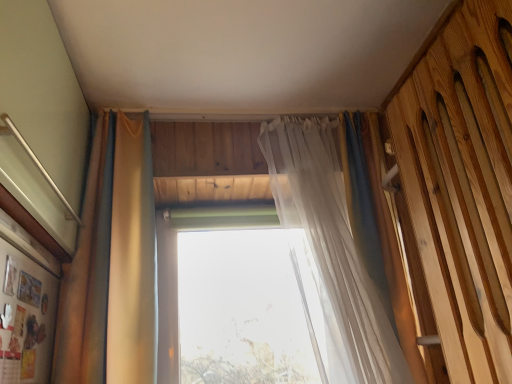
This screenshot has width=512, height=384. Identify the location of wooden slats bed at right. (463, 185).

Where is `translucent fabric curtain at center, placed as the 1th curtain when sorted from right to left`? translucent fabric curtain at center, placed as the 1th curtain when sorted from right to left is located at coordinates (331, 250).

In the scene shown: What is the approximate width of translucent fabric curtain at center, placed as the 1th curtain when sorted from right to left?

The width of translucent fabric curtain at center, placed as the 1th curtain when sorted from right to left, is 20.40 centimeters.

Identify the location of transparent glass window at center. (238, 300).

Locate an element on the screen. wooden slats bed at right is located at coordinates (463, 185).

From the image's perspective, who appears lower, translucent fabric curtain at center, positioned as the second curtain in left-to-right order, or wooden slats bed at right?

translucent fabric curtain at center, positioned as the second curtain in left-to-right order.

Looking at the image, does translucent fabric curtain at center, placed as the 1th curtain when sorted from right to left, seem bigger or smaller compared to wooden slats bed at right?

Considering their sizes, translucent fabric curtain at center, placed as the 1th curtain when sorted from right to left, takes up more space than wooden slats bed at right.

Is translucent fabric curtain at center, positioned as the second curtain in left-to-right order, in front of wooden slats bed at right?

No, translucent fabric curtain at center, positioned as the second curtain in left-to-right order, is further to the viewer.

From the picture: How many degrees apart are the facing directions of transparent glass window at center and translucent fabric curtain at center, placed as the 1th curtain when sorted from right to left?

The angular difference between transparent glass window at center and translucent fabric curtain at center, placed as the 1th curtain when sorted from right to left, is 0.304 degrees.

Is transparent glass window at center outside of translucent fabric curtain at center, positioned as the second curtain in left-to-right order?

transparent glass window at center lies outside translucent fabric curtain at center, positioned as the second curtain in left-to-right order,'s area.

Is transparent glass window at center at the left side of translucent fabric curtain at center, positioned as the second curtain in left-to-right order?

Yes, transparent glass window at center is to the left of translucent fabric curtain at center, positioned as the second curtain in left-to-right order.

Can you confirm if transparent glass window at center is wider than translucent fabric curtain at center, placed as the 1th curtain when sorted from right to left?

No.

Does transparent glass window at center have a larger size compared to matte gold curtain at left, which is the 2th curtain from right to left?

No.

Between point (274, 231) and point (83, 382), which one is positioned in front?

The point (83, 382) is closer to the camera.

Consider the image. Considering the relative sizes of transparent glass window at center and matte gold curtain at left, placed as the first curtain when sorted from left to right, in the image provided, is transparent glass window at center shorter than matte gold curtain at left, placed as the first curtain when sorted from left to right,?

Indeed, transparent glass window at center has a lesser height compared to matte gold curtain at left, placed as the first curtain when sorted from left to right.

Which of these two, matte gold curtain at left, placed as the first curtain when sorted from left to right, or wooden slats bed at right, stands taller?

matte gold curtain at left, placed as the first curtain when sorted from left to right.

Considering their positions, is matte gold curtain at left, placed as the first curtain when sorted from left to right, located in front of or behind wooden slats bed at right?

matte gold curtain at left, placed as the first curtain when sorted from left to right, is behind wooden slats bed at right.

Which is closer, (135, 223) or (414, 162)?

The point (414, 162) is closer.

Between translucent fabric curtain at center, placed as the 1th curtain when sorted from right to left, and matte gold curtain at left, which is the 2th curtain from right to left, which one has smaller size?

matte gold curtain at left, which is the 2th curtain from right to left, is smaller.

Looking at their sizes, would you say translucent fabric curtain at center, positioned as the second curtain in left-to-right order, is wider or thinner than matte gold curtain at left, which is the 2th curtain from right to left?

Clearly, translucent fabric curtain at center, positioned as the second curtain in left-to-right order, has more width compared to matte gold curtain at left, which is the 2th curtain from right to left.

Is translucent fabric curtain at center, placed as the 1th curtain when sorted from right to left, positioned in front of matte gold curtain at left, placed as the first curtain when sorted from left to right?

No, it is behind matte gold curtain at left, placed as the first curtain when sorted from left to right.

Does point (379, 307) come farther from viewer compared to point (99, 310)?

That is True.

Does wooden slats bed at right have a greater width compared to translucent fabric curtain at center, positioned as the second curtain in left-to-right order?

No, wooden slats bed at right is not wider than translucent fabric curtain at center, positioned as the second curtain in left-to-right order.

This screenshot has height=384, width=512. In order to click on curtain that is the 1st one above the wooden slats bed at right (from a real-world perspective) in this screenshot , I will do `click(331, 250)`.

Is wooden slats bed at right beside translucent fabric curtain at center, positioned as the second curtain in left-to-right order?

No, wooden slats bed at right is not next to translucent fabric curtain at center, positioned as the second curtain in left-to-right order.

Which is more to the left, wooden slats bed at right or translucent fabric curtain at center, placed as the 1th curtain when sorted from right to left?

translucent fabric curtain at center, placed as the 1th curtain when sorted from right to left.

Which is behind, point (485, 320) or point (66, 343)?

The point (66, 343) is farther from the camera.

From the image's perspective, which one is positioned higher, wooden slats bed at right or matte gold curtain at left, placed as the first curtain when sorted from left to right?

wooden slats bed at right, from the image's perspective.

I want to click on the 1st curtain to the left when counting from the wooden slats bed at right, so click(331, 250).

Which curtain is the 1st one when counting from the front of the transparent glass window at center? Please provide its 2D coordinates.

[(331, 250)]

From the image, which object appears to be nearer to wooden slats bed at right, translucent fabric curtain at center, positioned as the second curtain in left-to-right order, or matte gold curtain at left, which is the 2th curtain from right to left?

Based on the image, translucent fabric curtain at center, positioned as the second curtain in left-to-right order, appears to be nearer to wooden slats bed at right.

Based on their spatial positions, is translucent fabric curtain at center, positioned as the second curtain in left-to-right order, or wooden slats bed at right further from transparent glass window at center?

wooden slats bed at right.

From the image, which object appears to be farther from transparent glass window at center, matte gold curtain at left, placed as the first curtain when sorted from left to right, or translucent fabric curtain at center, placed as the 1th curtain when sorted from right to left?

Among the two, matte gold curtain at left, placed as the first curtain when sorted from left to right, is located further to transparent glass window at center.

Looking at this image, estimate the real-world distances between objects in this image. Which object is further from transparent glass window at center, wooden slats bed at right or matte gold curtain at left, placed as the first curtain when sorted from left to right?

Among the two, wooden slats bed at right is located further to transparent glass window at center.

Which object lies nearer to the anchor point matte gold curtain at left, placed as the first curtain when sorted from left to right, wooden slats bed at right or translucent fabric curtain at center, placed as the 1th curtain when sorted from right to left?

Among the two, translucent fabric curtain at center, placed as the 1th curtain when sorted from right to left, is located nearer to matte gold curtain at left, placed as the first curtain when sorted from left to right.

Based on the photo, when comparing their distances from translucent fabric curtain at center, placed as the 1th curtain when sorted from right to left, does wooden slats bed at right or matte gold curtain at left, which is the 2th curtain from right to left, seem further?

matte gold curtain at left, which is the 2th curtain from right to left, lies further to translucent fabric curtain at center, placed as the 1th curtain when sorted from right to left, than the other object.

From the image, which object appears to be farther from matte gold curtain at left, which is the 2th curtain from right to left, translucent fabric curtain at center, positioned as the second curtain in left-to-right order, or transparent glass window at center?

Among the two, translucent fabric curtain at center, positioned as the second curtain in left-to-right order, is located further to matte gold curtain at left, which is the 2th curtain from right to left.

Based on their spatial positions, is matte gold curtain at left, which is the 2th curtain from right to left, or transparent glass window at center further from wooden slats bed at right?

Among the two, matte gold curtain at left, which is the 2th curtain from right to left, is located further to wooden slats bed at right.

Identify the location of curtain between matte gold curtain at left, which is the 2th curtain from right to left, and wooden slats bed at right from left to right. This screenshot has width=512, height=384. (331, 250).

I want to click on window between matte gold curtain at left, placed as the first curtain when sorted from left to right, and translucent fabric curtain at center, placed as the 1th curtain when sorted from right to left, in the horizontal direction, so click(238, 300).

Locate an element on the screen. This screenshot has height=384, width=512. window located between matte gold curtain at left, placed as the first curtain when sorted from left to right, and wooden slats bed at right in the left-right direction is located at coordinates (238, 300).